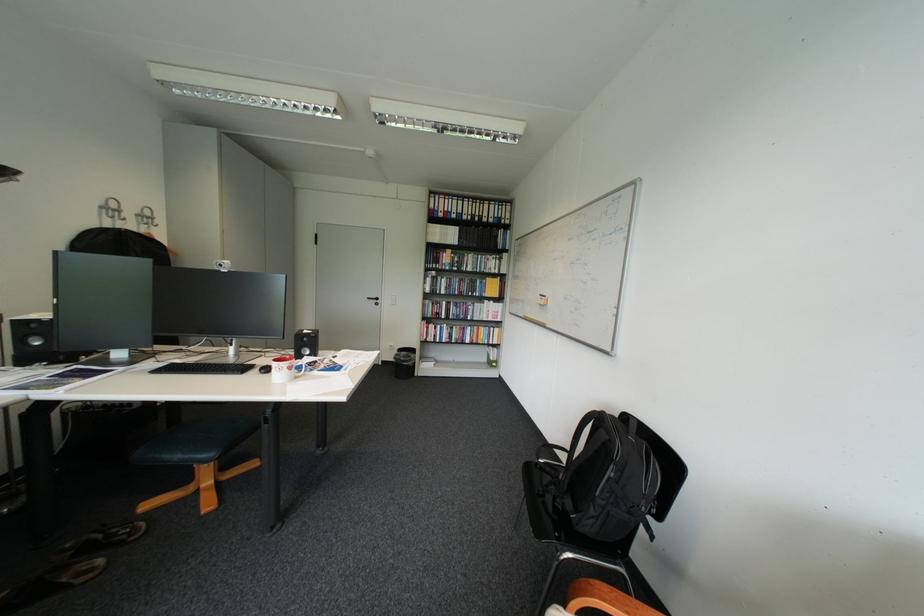
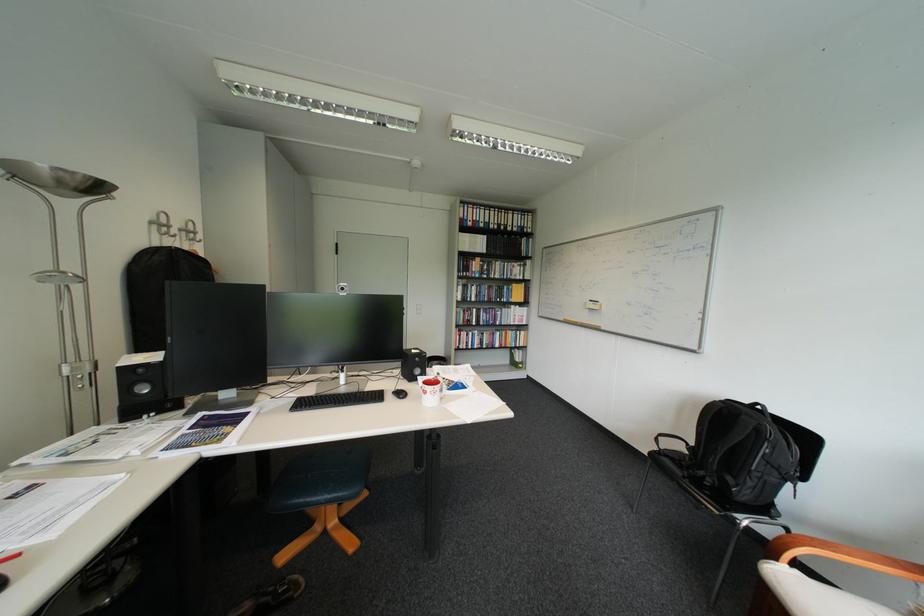
Locate, in the second image, the point that corresponds to point 477,294 in the first image.

(505, 301)